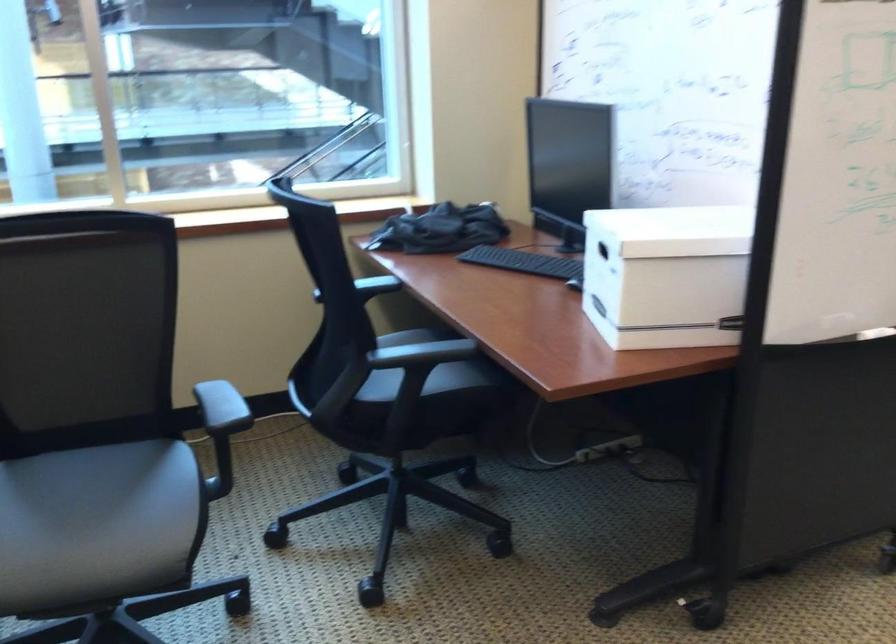
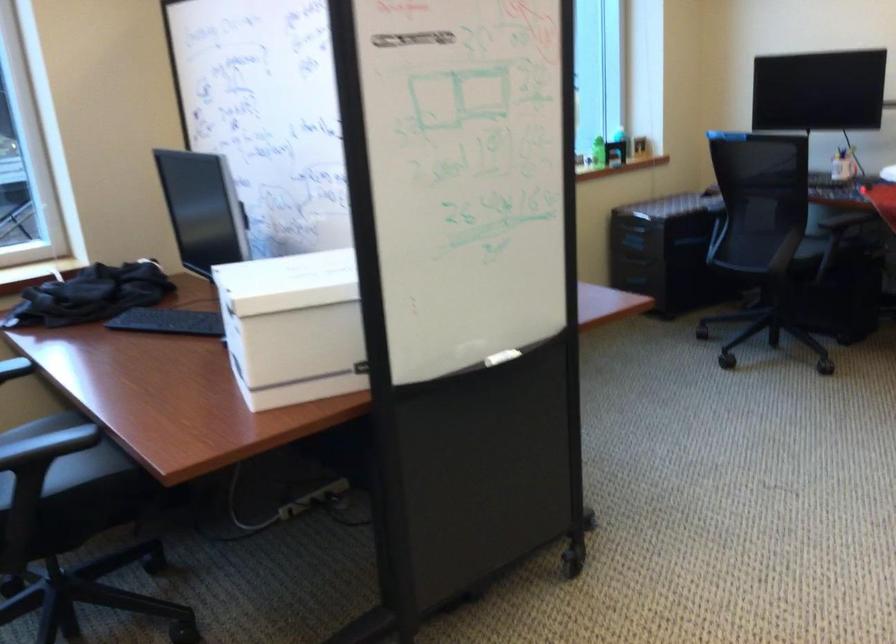
Locate, in the second image, the point that corresponds to point (428, 377) in the first image.

(65, 464)